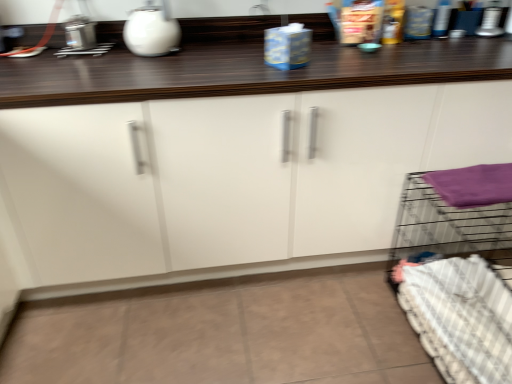
The height and width of the screenshot is (384, 512). Describe the element at coordinates (461, 318) in the screenshot. I see `white checkered bedding at lower right` at that location.

What is the approximate width of purple fabric at right?

22.57 centimeters.

The height and width of the screenshot is (384, 512). What do you see at coordinates (151, 30) in the screenshot? I see `white glossy kettle at upper center` at bounding box center [151, 30].

Locate an element on the screen. The height and width of the screenshot is (384, 512). white checkered bedding at lower right is located at coordinates (461, 318).

How different are the orientations of white glossy kettle at upper center and white checkered bedding at lower right in degrees?

white glossy kettle at upper center and white checkered bedding at lower right are facing 91.3 degrees away from each other.

Identify the location of appliance above the white checkered bedding at lower right (from the image's perspective). (151, 30).

Is white glossy kettle at upper center far away from white checkered bedding at lower right?

Yes, white glossy kettle at upper center and white checkered bedding at lower right are quite far apart.

Who is shorter, white glossy kettle at upper center or white checkered bedding at lower right?

white glossy kettle at upper center.

Which of these two, purple fabric at right or white glossy cabinet at center, stands taller?

Standing taller between the two is white glossy cabinet at center.

What's the angular difference between purple fabric at right and white glossy cabinet at center's facing directions?

The facing directions of purple fabric at right and white glossy cabinet at center are 0.322 degrees apart.

From the image's perspective, does purple fabric at right appear higher than white glossy cabinet at center?

Actually, purple fabric at right appears below white glossy cabinet at center in the image.

Could you tell me if purple fabric at right is turned towards white glossy cabinet at center?

No, purple fabric at right is not turned towards white glossy cabinet at center.

Looking at this image, could you tell me if purple fabric at right is turned towards white glossy kettle at upper center?

No, purple fabric at right does not turn towards white glossy kettle at upper center.

At what (x,y) coordinates should I click in order to perform the action: click on appliance on the left of the purple fabric at right. Please return your answer as a coordinate pair (x, y). This screenshot has width=512, height=384. Looking at the image, I should click on (151, 30).

From the image's perspective, is purple fabric at right located above or below white glossy kettle at upper center?

purple fabric at right is situated lower than white glossy kettle at upper center in the image.

Considering the relative positions of purple fabric at right and white glossy kettle at upper center in the image provided, is purple fabric at right to the left of white glossy kettle at upper center from the viewer's perspective?

Incorrect, purple fabric at right is not on the left side of white glossy kettle at upper center.

Who is taller, white glossy cabinet at center or white checkered bedding at lower right?

white glossy cabinet at center.

How distant is white glossy cabinet at center from white checkered bedding at lower right?

They are 61.81 centimeters apart.

Is white glossy cabinet at center positioned with its back to white checkered bedding at lower right?

Correct, white glossy cabinet at center is looking away from white checkered bedding at lower right.

Considering the positions of objects white glossy cabinet at center and white checkered bedding at lower right in the image provided, who is more to the right, white glossy cabinet at center or white checkered bedding at lower right?

Positioned to the right is white checkered bedding at lower right.

Is white checkered bedding at lower right not near white glossy kettle at upper center?

white checkered bedding at lower right is positioned a significant distance from white glossy kettle at upper center.

Based on their positions, is white checkered bedding at lower right located to the left or right of white glossy kettle at upper center?

Based on their positions, white checkered bedding at lower right is located to the right of white glossy kettle at upper center.

What's the angular difference between white checkered bedding at lower right and white glossy kettle at upper center's facing directions?

The angle between the facing direction of white checkered bedding at lower right and the facing direction of white glossy kettle at upper center is 91.3 degrees.

Which of these two, white checkered bedding at lower right or white glossy kettle at upper center, is thinner?

Thinner between the two is white glossy kettle at upper center.

Could you tell me if white glossy cabinet at center is turned towards purple fabric at right?

Yes, white glossy cabinet at center is turned towards purple fabric at right.

Considering the relative sizes of white glossy cabinet at center and purple fabric at right in the image provided, is white glossy cabinet at center bigger than purple fabric at right?

Yes.

Is white glossy cabinet at center next to purple fabric at right?

No, white glossy cabinet at center is not touching purple fabric at right.

Considering the sizes of white glossy cabinet at center and purple fabric at right in the image, is white glossy cabinet at center wider or thinner than purple fabric at right?

Considering their sizes, white glossy cabinet at center looks broader than purple fabric at right.

Is white glossy kettle at upper center aimed at white glossy cabinet at center?

No, white glossy kettle at upper center is not aimed at white glossy cabinet at center.

Consider the image. Is white glossy kettle at upper center positioned beyond the bounds of white glossy cabinet at center?

No, most part of white glossy kettle at upper center lies within white glossy cabinet at center.

From a real-world perspective, is white glossy kettle at upper center on top of white glossy cabinet at center?

Yes, from a real-world perspective, white glossy kettle at upper center is on top of white glossy cabinet at center.

Identify the location of bedding below the white glossy kettle at upper center (from a real-world perspective). This screenshot has width=512, height=384. (461, 318).

Find the location of `bath towel behind the white glossy cabinet at center`. bath towel behind the white glossy cabinet at center is located at coordinates (473, 185).

Consider the image. Looking at the image, which one is located closer to purple fabric at right, white glossy kettle at upper center or white glossy cabinet at center?

Based on the image, white glossy cabinet at center appears to be nearer to purple fabric at right.

Considering their positions, is white glossy kettle at upper center positioned closer to white checkered bedding at lower right than white glossy cabinet at center?

Based on the image, white glossy cabinet at center appears to be nearer to white checkered bedding at lower right.

Based on their spatial positions, is purple fabric at right or white checkered bedding at lower right further from white glossy cabinet at center?

white checkered bedding at lower right is further to white glossy cabinet at center.

Based on their spatial positions, is white glossy cabinet at center or white checkered bedding at lower right closer to white glossy kettle at upper center?

white glossy cabinet at center is closer to white glossy kettle at upper center.

Looking at the image, which one is located closer to purple fabric at right, white glossy cabinet at center or white glossy kettle at upper center?

The object closer to purple fabric at right is white glossy cabinet at center.

From the image, which object appears to be farther from white checkered bedding at lower right, white glossy kettle at upper center or purple fabric at right?

Among the two, white glossy kettle at upper center is located further to white checkered bedding at lower right.

Considering their positions, is white checkered bedding at lower right positioned closer to white glossy kettle at upper center than white glossy cabinet at center?

white glossy cabinet at center lies closer to white glossy kettle at upper center than the other object.

Looking at the image, which one is located closer to white checkered bedding at lower right, purple fabric at right or white glossy kettle at upper center?

purple fabric at right is positioned closer to the anchor white checkered bedding at lower right.

This screenshot has width=512, height=384. What are the coordinates of `cabinetry between white glossy kettle at upper center and purple fabric at right in the horizontal direction` in the screenshot? It's located at (228, 177).

The width and height of the screenshot is (512, 384). I want to click on bath towel between white glossy kettle at upper center and white checkered bedding at lower right, so click(473, 185).

Locate an element on the screen. The image size is (512, 384). cabinetry situated between white glossy kettle at upper center and white checkered bedding at lower right from left to right is located at coordinates (228, 177).

Where is `bath towel located between white glossy cabinet at center and white checkered bedding at lower right in the left-right direction`? The image size is (512, 384). bath towel located between white glossy cabinet at center and white checkered bedding at lower right in the left-right direction is located at coordinates (473, 185).